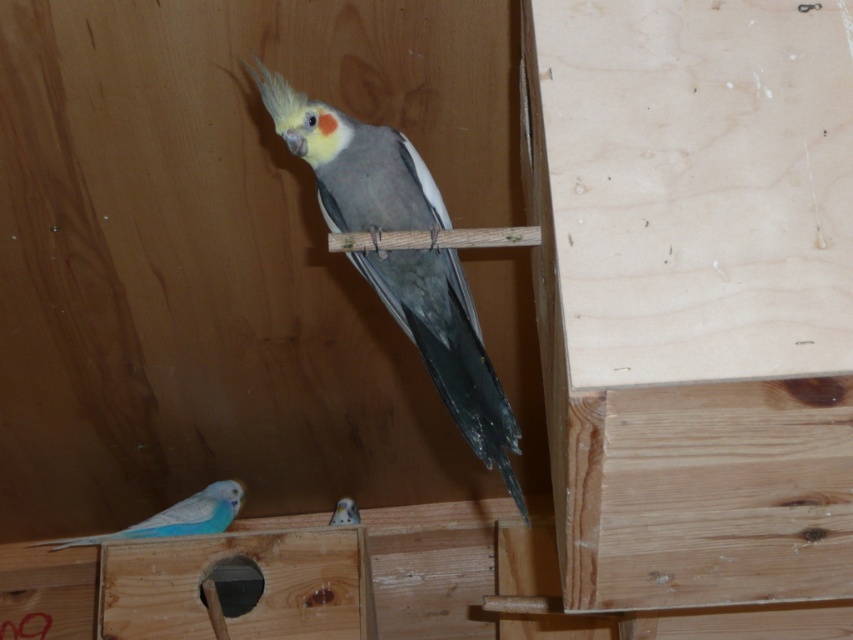
Question: Can you confirm if gray matte parrot at center is thinner than matte blue parrot at lower left?

Choices:
 (A) no
 (B) yes

Answer: (A)

Question: Which point is closer to the camera?

Choices:
 (A) coord(346,520)
 (B) coord(171,515)
 (C) coord(306,116)

Answer: (C)

Question: Can you confirm if gray matte parrot at center is positioned to the right of blue glossy parakeet at lower left?

Choices:
 (A) yes
 (B) no

Answer: (A)

Question: Which point is farther to the camera?

Choices:
 (A) (45, 540)
 (B) (432, 323)

Answer: (A)

Question: Among these points, which one is farthest from the camera?

Choices:
 (A) coord(334,518)
 (B) coord(187,520)
 (C) coord(440,356)

Answer: (A)

Question: Can you confirm if blue glossy parakeet at lower left is positioned below matte blue parrot at lower left?

Choices:
 (A) yes
 (B) no

Answer: (A)